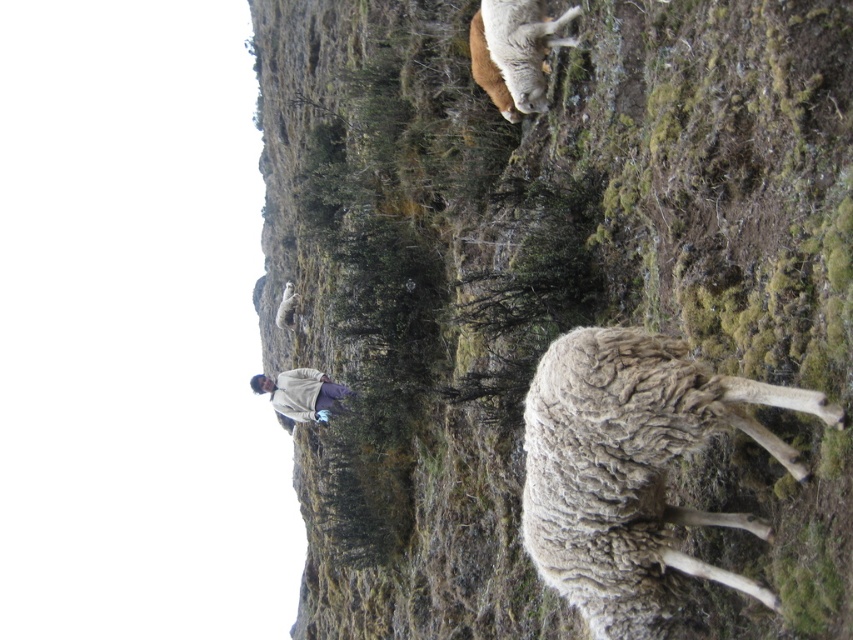
Who is lower down, white woolen sheep at right or light gray woolen sweater at center?

light gray woolen sweater at center is below.

Which is above, white woolen sheep at right or light gray woolen sweater at center?

white woolen sheep at right is higher up.

Where is `white woolen sheep at right`? white woolen sheep at right is located at coordinates (633, 470).

Who is more distant from viewer, (339, 131) or (509, 28)?

The point (339, 131) is behind.

Between fuzzy wool sheep at center and white woolly sheep at upper center, which one has less height?

Standing shorter between the two is white woolly sheep at upper center.

What do you see at coordinates (527, 262) in the screenshot?
I see `fuzzy wool sheep at center` at bounding box center [527, 262].

I want to click on fuzzy wool sheep at center, so click(x=527, y=262).

Which of these two, white woolen sheep at right or white woolly sheep at upper center, stands taller?

white woolen sheep at right

From the picture: Can you confirm if white woolen sheep at right is thinner than white woolly sheep at upper center?

In fact, white woolen sheep at right might be wider than white woolly sheep at upper center.

Which is in front, point (704, 374) or point (503, 13)?

Point (704, 374)

Locate an element on the screen. This screenshot has width=853, height=640. white woolen sheep at right is located at coordinates (633, 470).